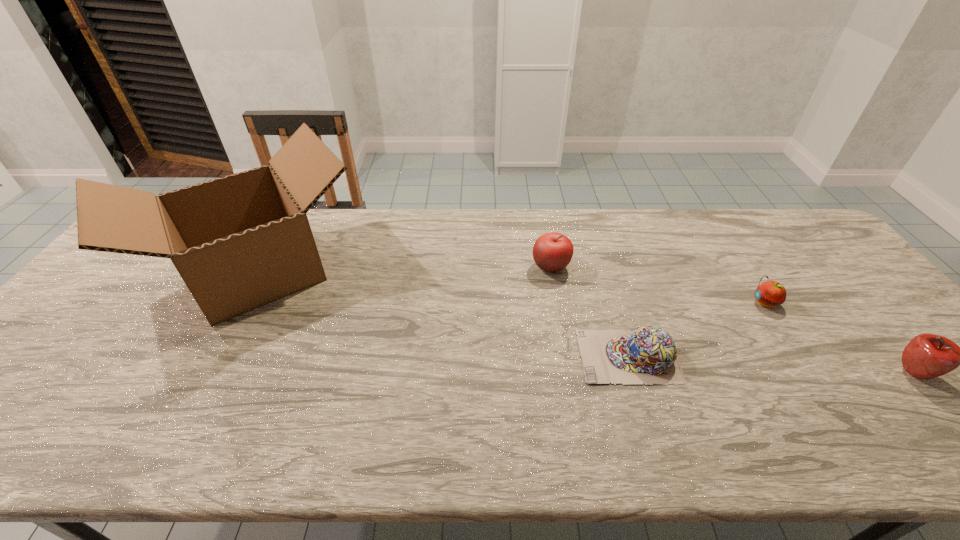
Where is `free space between the farthest apple and the leftmost object`? free space between the farthest apple and the leftmost object is located at coordinates pos(404,269).

At what (x,y) coordinates should I click in order to perform the action: click on vacant area that lies between the leftmost object and the fourth object from left to right. Please return your answer as a coordinate pair (x, y). Looking at the image, I should click on (511, 287).

Identify the location of free area in between the second object from right to left and the nearest apple. The height and width of the screenshot is (540, 960). (839, 338).

The width and height of the screenshot is (960, 540). In order to click on unoccupied position between the cap and the second apple from left to right in this screenshot , I will do `click(697, 329)`.

Where is `the fourth closest object to the farthest apple`? the fourth closest object to the farthest apple is located at coordinates (926, 356).

This screenshot has height=540, width=960. I want to click on object that is the closest one to the cap, so click(x=552, y=252).

Select which apple is the third closest to the cap. Please provide its 2D coordinates. Your answer should be formatted as a tuple, i.e. [(x, y)], where the tuple contains the x and y coordinates of a point satisfying the conditions above.

[(926, 356)]

At what (x,y) coordinates should I click in order to perform the action: click on apple identified as the closest to the farthest apple. Please return your answer as a coordinate pair (x, y). The height and width of the screenshot is (540, 960). Looking at the image, I should click on click(769, 294).

The image size is (960, 540). Identify the location of free point that satisfies the following two spatial constraints: 1. on the front side of the second object from right to left; 2. on the left side of the rightmost apple. (810, 373).

Find the location of a particular element. The height and width of the screenshot is (540, 960). blank space that satisfies the following two spatial constraints: 1. on the front, side, and top of the nearest apple; 2. on the left side of the cap is located at coordinates click(634, 373).